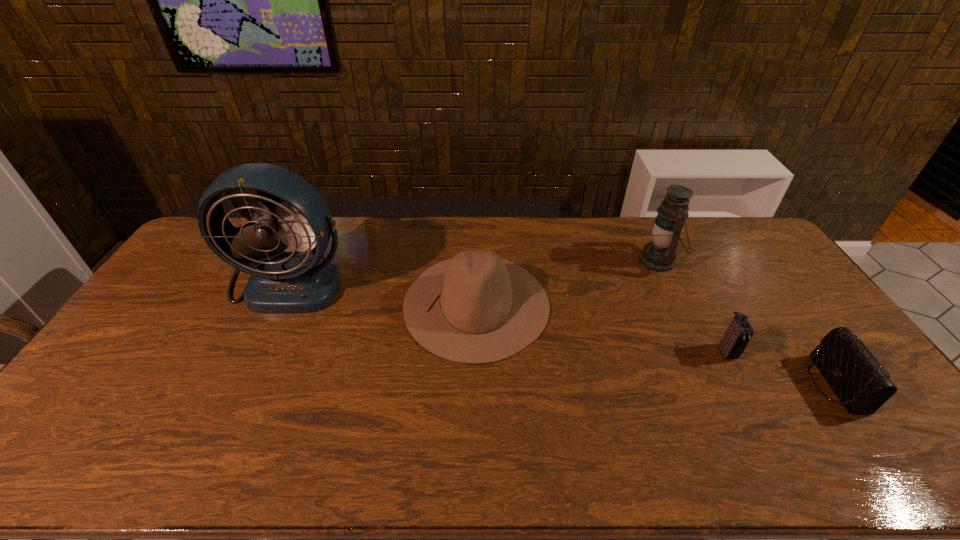
You are a GUI agent. You are given a task and a screenshot of the screen. Output one action in this format:
    pyautogui.click(x=<x>, y=<y>)
    Task: Click on the free space that satisfies the following two spatial constraints: 1. in front of the sombrero to blow air; 2. on the left side of the fan
    Image resolution: width=960 pixels, height=540 pixels.
    Given the screenshot: What is the action you would take?
    pyautogui.click(x=280, y=304)